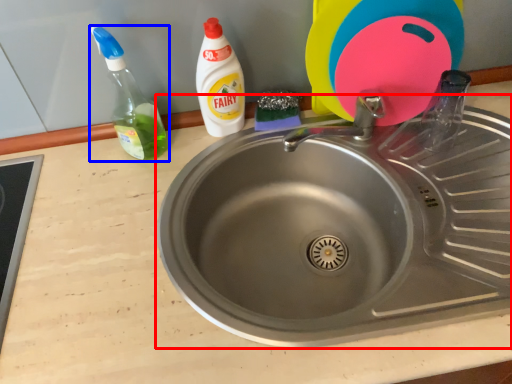
Question: Which point is closer to the camera, sink (highlighted by a red box) or bottle (highlighted by a blue box)?

Choices:
 (A) sink
 (B) bottle

Answer: (A)